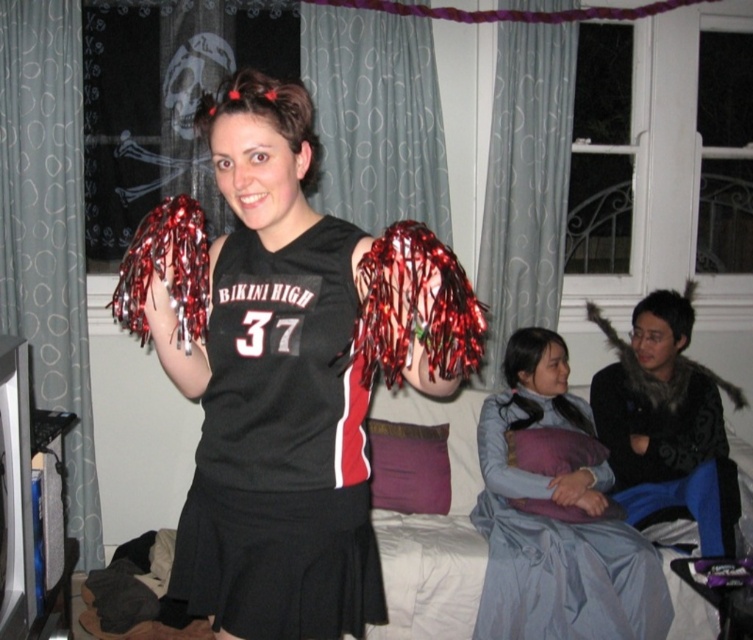
Consider the image. You are at a party and see the black jersey at center and the light blue satin dress at lower right. Which one is more to the left?

The black jersey at center is more to the left than the light blue satin dress at lower right.

You are standing in the room and want to know how far the point at coordinate (306, 595) is from you. Can you determine the distance?

The point at coordinate (306, 595) is 4.40 feet away from you.

You are a photographer at the event and need to position yourself to capture both the matte black cheerleader outfit at center and the black jersey at center in the same frame. Which direction should you move to ensure both are visible?

You should move to the left to ensure both the matte black cheerleader outfit at center and the black jersey at center are visible, as the matte black cheerleader outfit is to the right of the black jersey.